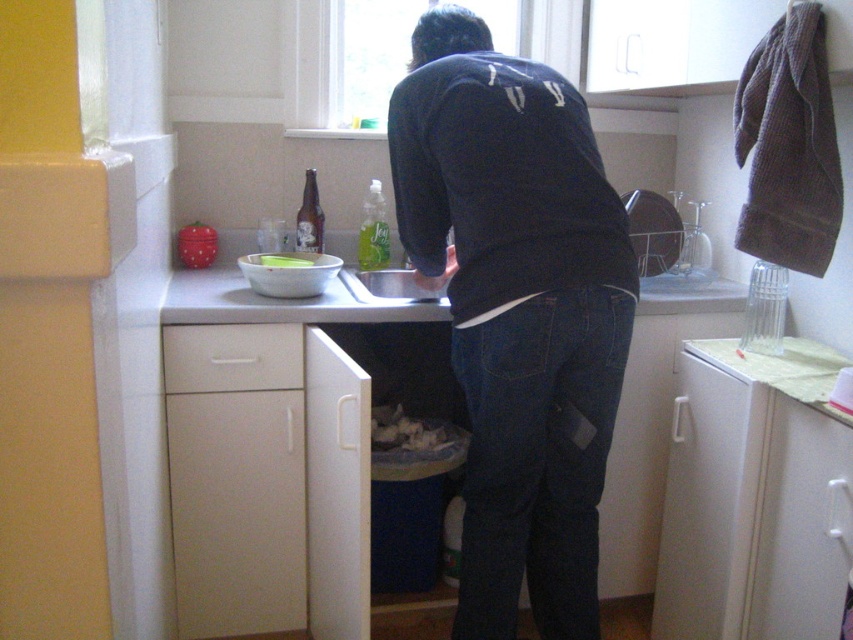
Who is more distant from viewer, [490,563] or [682,353]?

The point [682,353] is more distant.

This screenshot has height=640, width=853. Describe the element at coordinates (517, 310) in the screenshot. I see `dark blue sweater at center` at that location.

I want to click on dark blue sweater at center, so click(x=517, y=310).

Does white plastic dishwasher at lower right appear on the right side of brown glass bottle at center?

Yes, white plastic dishwasher at lower right is to the right of brown glass bottle at center.

Between white plastic dishwasher at lower right and brown glass bottle at center, which one is positioned higher?

Positioned higher is brown glass bottle at center.

Which is behind, point (796, 456) or point (303, 241)?

The point (303, 241) is more distant.

Find the location of a particular element. Image resolution: width=853 pixels, height=640 pixels. white plastic dishwasher at lower right is located at coordinates (750, 508).

Can you confirm if brown glass bottle at center is smaller than green plastic bowl at center?

No.

Who is lower down, brown glass bottle at center or green plastic bowl at center?

green plastic bowl at center is below.

Which is in front, point (312, 209) or point (306, 259)?

Point (306, 259) is in front.

Locate an element on the screen. The image size is (853, 640). brown glass bottle at center is located at coordinates (309, 216).